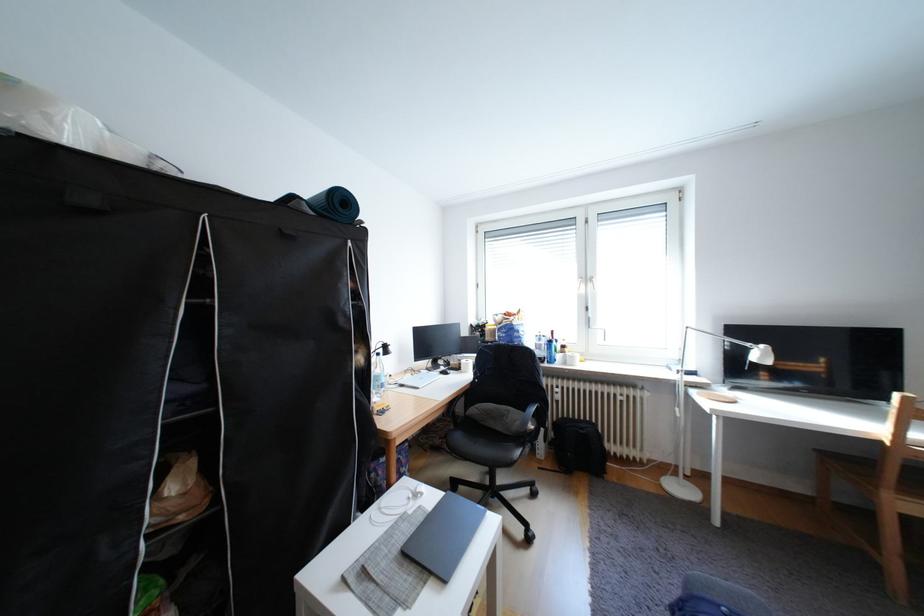
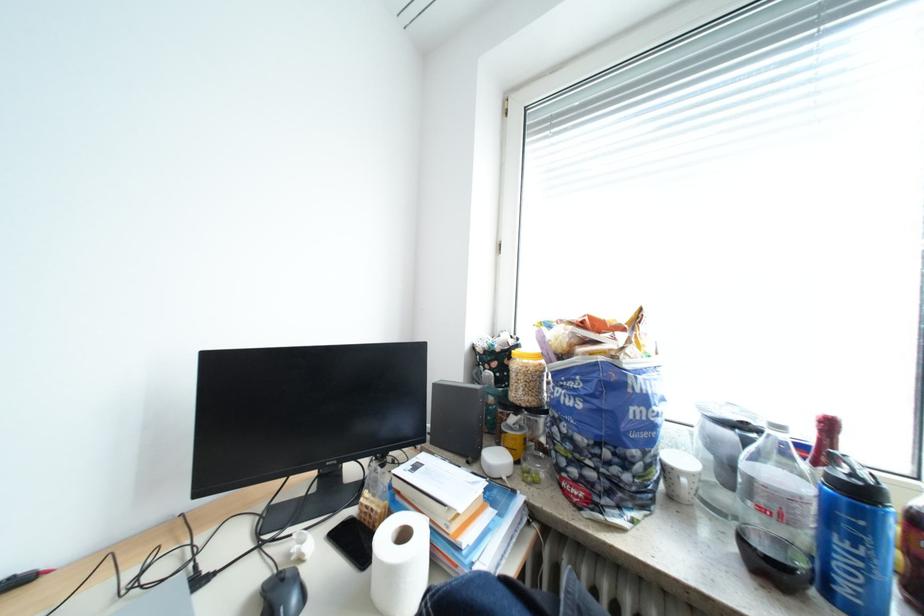
Where in the second image is the point corresponding to (563,342) from the first image?

(873, 493)